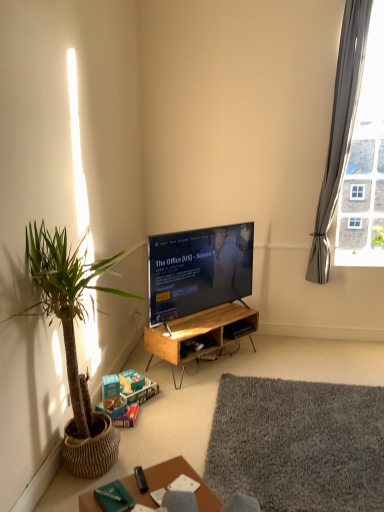
Where is `blank space situated above wooden table at lower center (from a real-world perspective)`? The image size is (384, 512). blank space situated above wooden table at lower center (from a real-world perspective) is located at coordinates (148, 495).